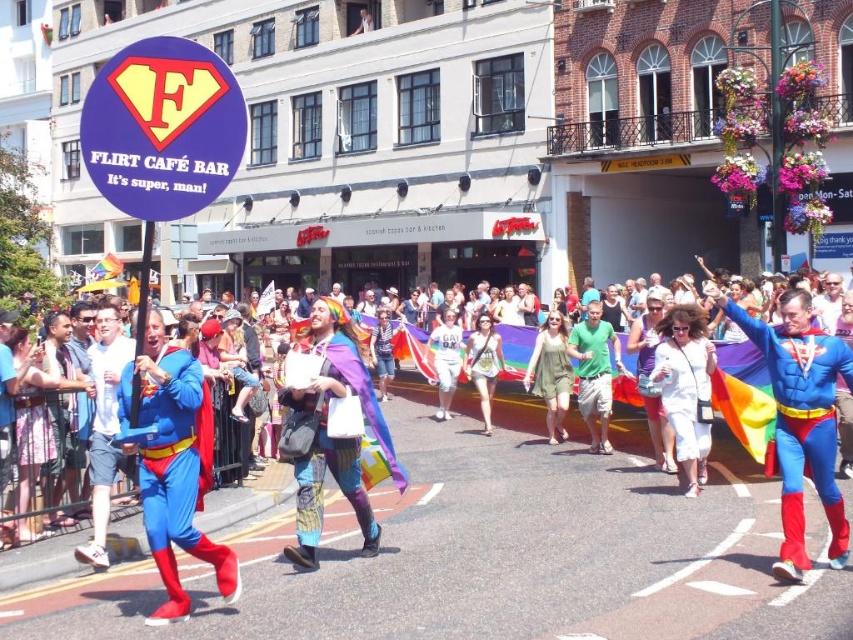
Question: Which object is positioned closest to the green cotton dress at center?

Choices:
 (A) shiny blue spandex suit at center
 (B) white matte dress at center
 (C) blue fabric superman costume at left
 (D) green fabric bag at center

Answer: (D)

Question: Among these points, which one is nearest to the camera?

Choices:
 (A) (454, 324)
 (B) (289, 552)
 (C) (148, 314)
 (D) (480, 397)

Answer: (C)

Question: Considering the relative positions of shiny blue costume at center and blue fabric costume at center in the image provided, where is shiny blue costume at center located with respect to blue fabric costume at center?

Choices:
 (A) left
 (B) right

Answer: (B)

Question: In this image, where is shiny blue costume at center located relative to green cotton dress at center?

Choices:
 (A) left
 (B) right

Answer: (A)

Question: Estimate the real-world distances between objects in this image. Which object is closer to the white cotton dress at center?

Choices:
 (A) blue fabric costume at center
 (B) multicolored fabric cape at center
 (C) blue fabric superman costume at left
 (D) green fabric bag at center

Answer: (D)

Question: Is blue fabric superman costume at left further to camera compared to green fabric bag at center?

Choices:
 (A) no
 (B) yes

Answer: (A)